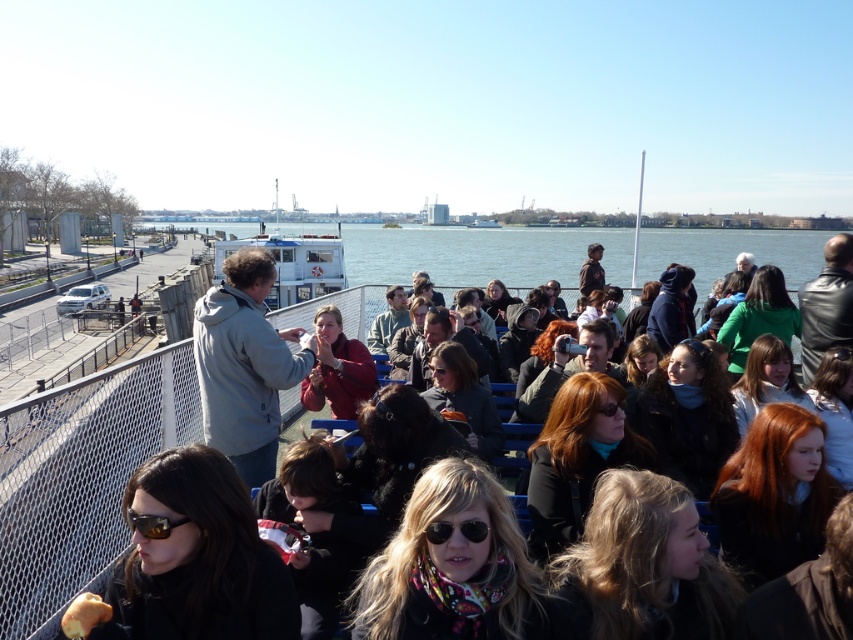
You are a photographer trying to capture the scene of the ferry ride. You notice the point at coordinate (x=195, y=557) where the matte black sunglasses at lower left are located. If you want to include both the matte black sunglasses at lower left and the group of seated individuals in your photo, which direction should you pan your camera to ensure both are in frame?

The matte black sunglasses at lower left is located at point (x=195, y=557). To include both the matte black sunglasses at lower left and the group of seated individuals in the photo, you should pan your camera towards the lower left direction to ensure both elements are within the frame.

You are a photographer standing on the ferry and want to take a photo that includes both the gray matte jacket at upper left and the gray fleece jacket at center. Which jacket should you focus on first to ensure both are in the frame?

The gray matte jacket at upper left is taller than the gray fleece jacket at center, so you should focus on the gray fleece jacket at center first to ensure both are in the frame.

You are a photographer trying to capture a candid shot of the gray fleece jacket at center without including the matte black sunglasses at lower left in the frame. Is this possible given their positions?

The matte black sunglasses at lower left is closer to the viewer than the gray fleece jacket at center, so it would block the view of the jacket. Therefore, it might be challenging to capture the jacket without including the sunglasses in the frame.